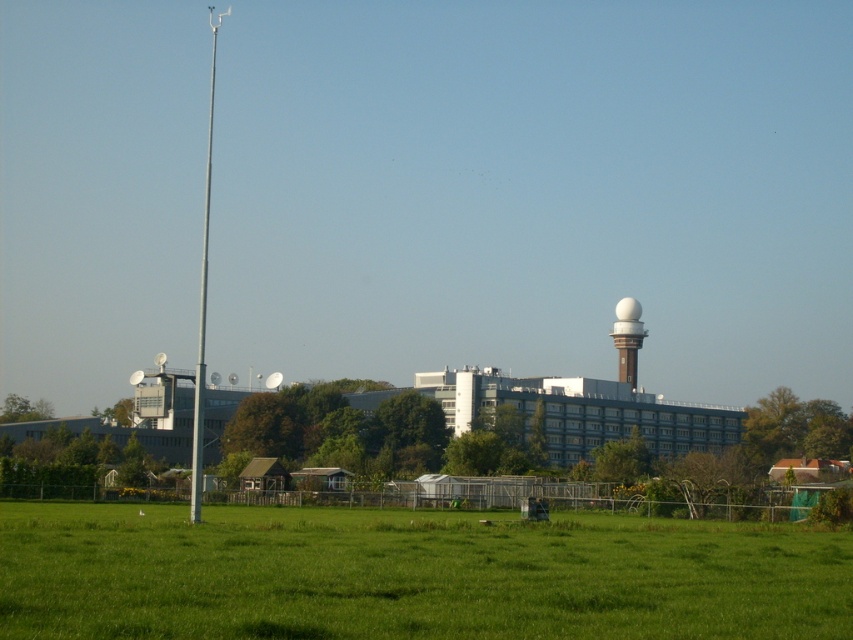
Based on the photo, you are standing in the open grassy field and want to take a photo of the white glossy water tower at upper center without the green grass at lower center blocking the view. Is this possible?

The green grass at lower center is closer to the viewer than the white glossy water tower at upper center, so the grass will block the view of the water tower. You cannot take a photo without the grass blocking it.

Based on the scene description, where is the point located at coordinates (410, 573)?

The point at coordinates (410, 573) is located on the green grass at lower center.